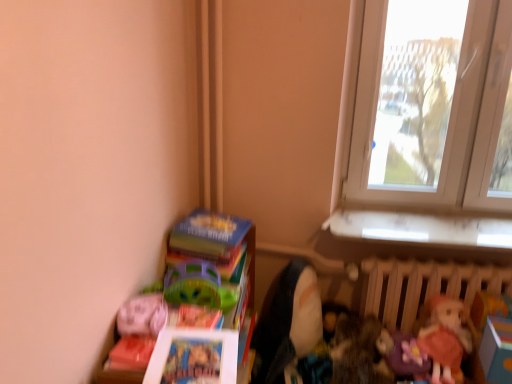
Find the location of a particular element. This screenshot has width=512, height=384. wooden radiator at lower right is located at coordinates (422, 286).

This screenshot has width=512, height=384. Describe the element at coordinates (422, 286) in the screenshot. I see `wooden radiator at lower right` at that location.

This screenshot has height=384, width=512. I want to click on matte plastic books at lower left, so click(x=168, y=303).

Locate an element on the screen. The image size is (512, 384). soft plush doll at lower right, which is the 1th doll in left-to-right order is located at coordinates (287, 321).

At what (x,y) coordinates should I click in order to perform the action: click on white plastic window at upper right. Please return your answer as a coordinate pair (x, y). The width and height of the screenshot is (512, 384). Looking at the image, I should click on (448, 123).

What are the coordinates of `matte pink doll at lower right, which appears as the 1th doll when viewed from the right` in the screenshot? It's located at (394, 348).

Locate an element on the screen. The height and width of the screenshot is (384, 512). matte pink plush at lower left is located at coordinates (142, 315).

This screenshot has height=384, width=512. What do you see at coordinates (142, 315) in the screenshot? I see `matte pink plush at lower left` at bounding box center [142, 315].

Identify the location of hardcover book at lower left. The height and width of the screenshot is (384, 512). (208, 235).

How different are the orientations of hardcover book at lower left and matte pink doll at lower right, arranged as the second doll when viewed from the left, in degrees?

The angular difference between hardcover book at lower left and matte pink doll at lower right, arranged as the second doll when viewed from the left, is 80.7 degrees.

Which of these two, hardcover book at lower left or matte pink doll at lower right, which appears as the 1th doll when viewed from the right, is bigger?

With larger size is hardcover book at lower left.

Could you tell me if hardcover book at lower left is turned towards matte pink doll at lower right, which appears as the 1th doll when viewed from the right?

No, hardcover book at lower left is not turned towards matte pink doll at lower right, which appears as the 1th doll when viewed from the right.

Which object is wider, hardcover book at lower left or matte pink doll at lower right, arranged as the second doll when viewed from the left?

Wider between the two is hardcover book at lower left.

Which of these two, matte pink plush at lower left or soft plush doll at lower right, which is counted as the 2th doll, starting from the right, is smaller?

matte pink plush at lower left.

From the picture: From a real-world perspective, which is physically below, matte pink plush at lower left or soft plush doll at lower right, which is the 1th doll in left-to-right order?

soft plush doll at lower right, which is the 1th doll in left-to-right order, is physically lower.

Is matte pink plush at lower left located outside soft plush doll at lower right, which is the 1th doll in left-to-right order?

That's correct, matte pink plush at lower left is outside of soft plush doll at lower right, which is the 1th doll in left-to-right order.

Is matte pink plush at lower left positioned with its back to soft plush doll at lower right, which is counted as the 2th doll, starting from the right?

That's not correct — matte pink plush at lower left is not looking away from soft plush doll at lower right, which is counted as the 2th doll, starting from the right.

Is matte plastic books at lower left outside of soft plush doll at lower right, which is the 1th doll in left-to-right order?

matte plastic books at lower left lies outside soft plush doll at lower right, which is the 1th doll in left-to-right order,'s area.

Is matte plastic books at lower left further to the viewer compared to soft plush doll at lower right, which is the 1th doll in left-to-right order?

No, matte plastic books at lower left is in front of soft plush doll at lower right, which is the 1th doll in left-to-right order.

Considering the points (143, 308) and (303, 356), which point is behind, point (143, 308) or point (303, 356)?

The point (303, 356) is farther.

Would you say matte plastic books at lower left is a long distance from soft plush doll at lower right, which is counted as the 2th doll, starting from the right?

No, matte plastic books at lower left is not far from soft plush doll at lower right, which is counted as the 2th doll, starting from the right.

Considering the positions of objects white plastic window at upper right and wooden radiator at lower right in the image provided, who is more to the left, white plastic window at upper right or wooden radiator at lower right?

From the viewer's perspective, white plastic window at upper right appears more on the left side.

Identify the location of radiator located on the right of white plastic window at upper right. Image resolution: width=512 pixels, height=384 pixels. (422, 286).

Can you tell me how much white plastic window at upper right and wooden radiator at lower right differ in facing direction?

white plastic window at upper right and wooden radiator at lower right are facing 1.26 degrees away from each other.

From a real-world perspective, is soft plush doll at lower right, which is counted as the 2th doll, starting from the right, beneath matte pink doll at lower right, arranged as the second doll when viewed from the left?

Yes, from a real-world perspective, soft plush doll at lower right, which is counted as the 2th doll, starting from the right, is below matte pink doll at lower right, arranged as the second doll when viewed from the left.

Does soft plush doll at lower right, which is the 1th doll in left-to-right order, have a greater height compared to matte pink doll at lower right, arranged as the second doll when viewed from the left?

Yes.

Looking at this image, is matte pink plush at lower left positioned far away from wooden radiator at lower right?

Yes.

Based on the photo, from the image's perspective, which is above, matte pink plush at lower left or wooden radiator at lower right?

matte pink plush at lower left appears higher in the image.

Is matte pink plush at lower left spatially inside wooden radiator at lower right, or outside of it?

matte pink plush at lower left is located beyond the bounds of wooden radiator at lower right.

Is soft plush doll at lower right, which is counted as the 2th doll, starting from the right, beside wooden radiator at lower right?

No.

Consider the image. From a real-world perspective, is soft plush doll at lower right, which is the 1th doll in left-to-right order, positioned under wooden radiator at lower right based on gravity?

Yes, from a real-world perspective, soft plush doll at lower right, which is the 1th doll in left-to-right order, is beneath wooden radiator at lower right.

Does soft plush doll at lower right, which is counted as the 2th doll, starting from the right, come in front of wooden radiator at lower right?

Yes, it is.

From the image's perspective, between soft plush doll at lower right, which is the 1th doll in left-to-right order, and wooden radiator at lower right, who is located below?

soft plush doll at lower right, which is the 1th doll in left-to-right order, appears lower in the image.

This screenshot has height=384, width=512. There is a matte pink doll at lower right, arranged as the second doll when viewed from the left. Identify the location of book above it (from a real-world perspective). (208, 235).

Locate an element on the screen. The height and width of the screenshot is (384, 512). toy located on the left of soft plush doll at lower right, which is the 1th doll in left-to-right order is located at coordinates (142, 315).

Considering their positions, is wooden radiator at lower right positioned closer to matte pink doll at lower right, which appears as the 1th doll when viewed from the right, than matte pink plush at lower left?

wooden radiator at lower right.

Which object lies nearer to the anchor point matte plastic books at lower left, matte pink doll at lower right, which appears as the 1th doll when viewed from the right, or hardcover book at lower left?

The object closer to matte plastic books at lower left is hardcover book at lower left.

Which object lies nearer to the anchor point matte plastic books at lower left, wooden radiator at lower right or matte pink doll at lower right, arranged as the second doll when viewed from the left?

Based on the image, matte pink doll at lower right, arranged as the second doll when viewed from the left, appears to be nearer to matte plastic books at lower left.

Considering their positions, is hardcover book at lower left positioned further to matte pink doll at lower right, arranged as the second doll when viewed from the left, than soft plush doll at lower right, which is the 1th doll in left-to-right order?

hardcover book at lower left lies further to matte pink doll at lower right, arranged as the second doll when viewed from the left, than the other object.

Considering their positions, is matte pink plush at lower left positioned further to hardcover book at lower left than white plastic window at upper right?

white plastic window at upper right is positioned further to the anchor hardcover book at lower left.

Considering their positions, is matte pink plush at lower left positioned closer to matte pink doll at lower right, which appears as the 1th doll when viewed from the right, than soft plush doll at lower right, which is counted as the 2th doll, starting from the right?

Based on the image, soft plush doll at lower right, which is counted as the 2th doll, starting from the right, appears to be nearer to matte pink doll at lower right, which appears as the 1th doll when viewed from the right.

Based on their spatial positions, is matte pink doll at lower right, arranged as the second doll when viewed from the left, or matte plastic books at lower left further from white plastic window at upper right?

matte plastic books at lower left lies further to white plastic window at upper right than the other object.

Estimate the real-world distances between objects in this image. Which object is closer to matte plastic books at lower left, matte pink plush at lower left or matte pink doll at lower right, which appears as the 1th doll when viewed from the right?

The object closer to matte plastic books at lower left is matte pink plush at lower left.

The height and width of the screenshot is (384, 512). What are the coordinates of `radiator between white plastic window at upper right and matte plastic books at lower left in the vertical direction` in the screenshot? It's located at pos(422,286).

At what (x,y) coordinates should I click in order to perform the action: click on doll located between hardcover book at lower left and matte pink doll at lower right, which appears as the 1th doll when viewed from the right, in the left-right direction. Please return your answer as a coordinate pair (x, y). Looking at the image, I should click on (287, 321).

Identify the location of doll situated between matte plastic books at lower left and matte pink doll at lower right, arranged as the second doll when viewed from the left, from left to right. The image size is (512, 384). (287, 321).

Find the location of a particular element. This screenshot has width=512, height=384. book between matte pink plush at lower left and soft plush doll at lower right, which is the 1th doll in left-to-right order, from front to back is located at coordinates (208, 235).